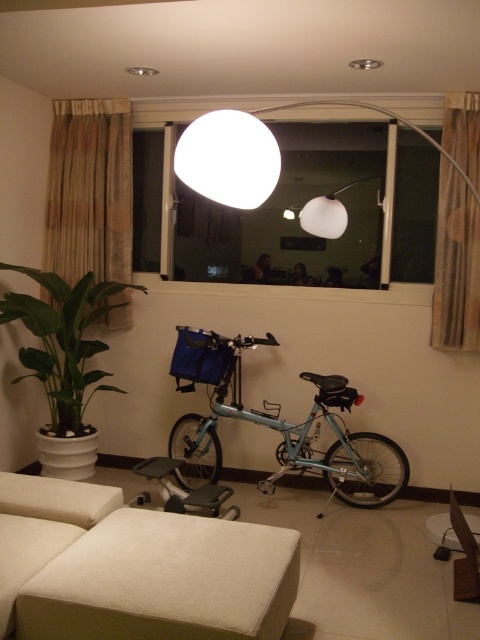
Question: Among these objects, which one is farthest from the camera?

Choices:
 (A) transparent glass window at center
 (B) green glossy plant at left

Answer: (A)

Question: Is light blue metallic bicycle at center positioned in front of green glossy plant at left?

Choices:
 (A) no
 (B) yes

Answer: (A)

Question: Can you confirm if transparent glass window at center is positioned to the left of light blue metallic bicycle at center?

Choices:
 (A) no
 (B) yes

Answer: (B)

Question: Is beige fabric ottoman at lower center to the right of green glossy plant at left from the viewer's perspective?

Choices:
 (A) yes
 (B) no

Answer: (A)

Question: Which of the following is the closest to the observer?

Choices:
 (A) transparent glass window at center
 (B) beige fabric ottoman at lower center
 (C) green glossy plant at left

Answer: (B)

Question: Which object is the closest to the transparent glass window at center?

Choices:
 (A) light blue metallic bicycle at center
 (B) beige fabric ottoman at lower center
 (C) green glossy plant at left
 (D) white fabric stool at lower right

Answer: (C)